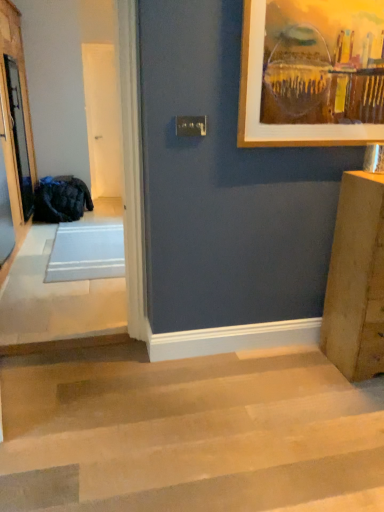
Question: Is white glossy door at center, marked as the first screen door in a right-to-left arrangement, at the right side of light brown wooden stairs at lower left?

Choices:
 (A) yes
 (B) no

Answer: (B)

Question: Is white glossy door at center, marked as the 1th screen door in a back-to-front arrangement, closer to camera compared to light brown wooden stairs at lower left?

Choices:
 (A) no
 (B) yes

Answer: (A)

Question: Can you confirm if white glossy door at center, marked as the first screen door in a right-to-left arrangement, is thinner than light brown wooden stairs at lower left?

Choices:
 (A) no
 (B) yes

Answer: (B)

Question: Considering the relative sizes of white glossy door at center, the 2th screen door when ordered from left to right, and light brown wooden stairs at lower left in the image provided, is white glossy door at center, the 2th screen door when ordered from left to right, wider than light brown wooden stairs at lower left?

Choices:
 (A) yes
 (B) no

Answer: (B)

Question: From a real-world perspective, does white glossy door at center, the 2th screen door when ordered from front to back, sit lower than light brown wooden stairs at lower left?

Choices:
 (A) yes
 (B) no

Answer: (B)

Question: Is light brown wooden stairs at lower left bigger or smaller than clear glass screen door at left, positioned as the second screen door in right-to-left order?

Choices:
 (A) small
 (B) big

Answer: (B)

Question: From the image's perspective, relative to clear glass screen door at left, which is counted as the second screen door, starting from the back, is light brown wooden stairs at lower left above or below?

Choices:
 (A) above
 (B) below

Answer: (B)

Question: In terms of height, does light brown wooden stairs at lower left look taller or shorter compared to clear glass screen door at left, the 1th screen door from the left?

Choices:
 (A) tall
 (B) short

Answer: (B)

Question: In the image, is light brown wooden stairs at lower left on the left side or the right side of clear glass screen door at left, which is counted as the second screen door, starting from the back?

Choices:
 (A) right
 (B) left

Answer: (A)

Question: Is clear glass screen door at left, the 1th screen door from the left, inside the boundaries of light brown wooden stairs at lower left, or outside?

Choices:
 (A) outside
 (B) inside

Answer: (A)

Question: Considering the positions of point (24, 125) and point (66, 398), is point (24, 125) closer or farther from the camera than point (66, 398)?

Choices:
 (A) closer
 (B) farther

Answer: (B)

Question: In the image, is clear glass screen door at left, the 1th screen door from the left, on the left side or the right side of light brown wooden stairs at lower left?

Choices:
 (A) left
 (B) right

Answer: (A)

Question: In the image, is clear glass screen door at left, positioned as the second screen door in right-to-left order, positioned in front of or behind light brown wooden stairs at lower left?

Choices:
 (A) front
 (B) behind

Answer: (B)

Question: Considering the positions of dark blue fabric bag at left and white glossy door at center, marked as the 1th screen door in a back-to-front arrangement, in the image, is dark blue fabric bag at left wider or thinner than white glossy door at center, marked as the 1th screen door in a back-to-front arrangement,?

Choices:
 (A) thin
 (B) wide

Answer: (B)

Question: Does point (79, 183) appear closer or farther from the camera than point (107, 60)?

Choices:
 (A) farther
 (B) closer

Answer: (B)